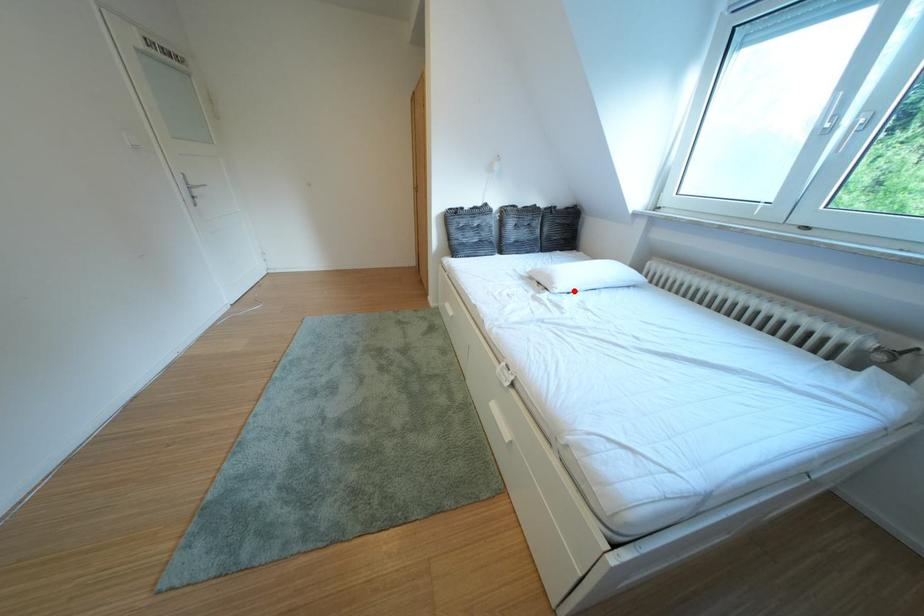
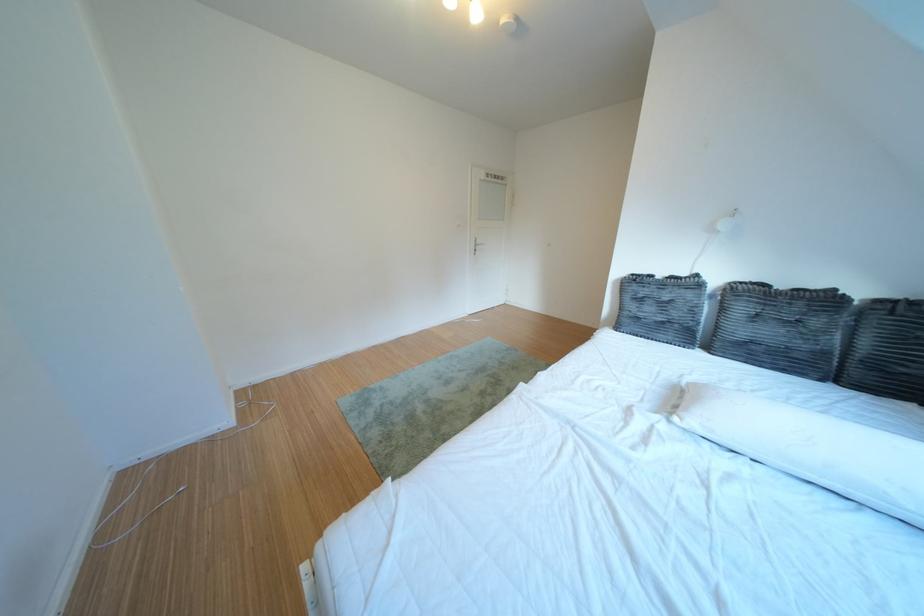
Question: I am providing you with two images of the same scene from different viewpoints. A red point is marked on the first image. Can you still see the location of the red point in image 2?

Choices:
 (A) Yes
 (B) No

Answer: (A)